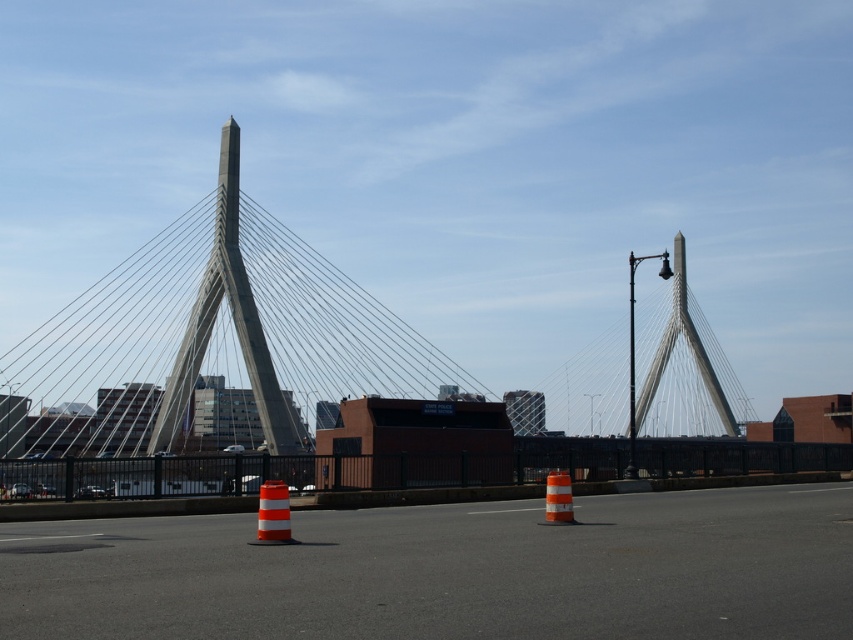
Does orange and white striped cone at center appear under orange reflective cone at center?

Actually, orange and white striped cone at center is above orange reflective cone at center.

In the scene shown: Between orange and white striped cone at center and orange reflective cone at center, which one has more height?

With more height is orange reflective cone at center.

Is point (279, 509) behind point (553, 500)?

No, (279, 509) is closer to viewer.

Where is `orange and white striped cone at center`? Image resolution: width=853 pixels, height=640 pixels. orange and white striped cone at center is located at coordinates (273, 513).

Who is lower down, orange striped traffic cones at center or gray concrete suspension bridge at center?

Positioned lower is orange striped traffic cones at center.

Who is more forward, [811,538] or [300,451]?

Point [811,538] is more forward.

Identify the location of orange striped traffic cones at center. The height and width of the screenshot is (640, 853). (450, 572).

Is orange striped traffic cones at center further to the viewer compared to orange reflective cone at center?

No, it is not.

Can you confirm if orange striped traffic cones at center is wider than orange reflective cone at center?

Correct, the width of orange striped traffic cones at center exceeds that of orange reflective cone at center.

Does point (352, 602) lie behind point (556, 500)?

No, (352, 602) is closer to viewer.

This screenshot has height=640, width=853. In order to click on orange striped traffic cones at center in this screenshot , I will do `click(450, 572)`.